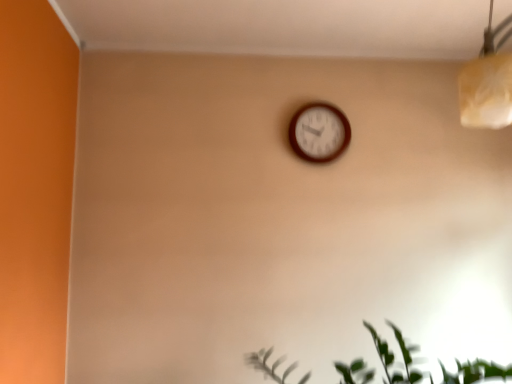
Question: Choose the correct answer: Is green leafy plant at lower right inside wooden wall clock at center or outside it?

Choices:
 (A) outside
 (B) inside

Answer: (A)

Question: Is point (385, 344) closer or farther from the camera than point (318, 119)?

Choices:
 (A) farther
 (B) closer

Answer: (B)

Question: From the image's perspective, is green leafy plant at lower right positioned above or below wooden wall clock at center?

Choices:
 (A) below
 (B) above

Answer: (A)

Question: From the image's perspective, is wooden wall clock at center positioned above or below green leafy plant at lower right?

Choices:
 (A) below
 (B) above

Answer: (B)

Question: Considering the positions of wooden wall clock at center and green leafy plant at lower right in the image, is wooden wall clock at center taller or shorter than green leafy plant at lower right?

Choices:
 (A) short
 (B) tall

Answer: (B)

Question: Is point pyautogui.click(x=312, y=155) closer or farther from the camera than point pyautogui.click(x=439, y=365)?

Choices:
 (A) farther
 (B) closer

Answer: (A)

Question: From a real-world perspective, is wooden wall clock at center above or below green leafy plant at lower right?

Choices:
 (A) below
 (B) above

Answer: (B)